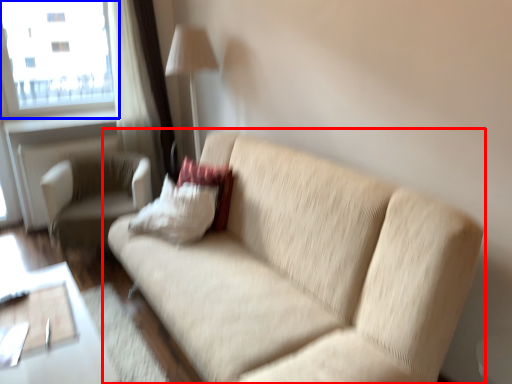
Question: Which object is further to the camera taking this photo, studio couch (highlighted by a red box) or window (highlighted by a blue box)?

Choices:
 (A) studio couch
 (B) window

Answer: (B)